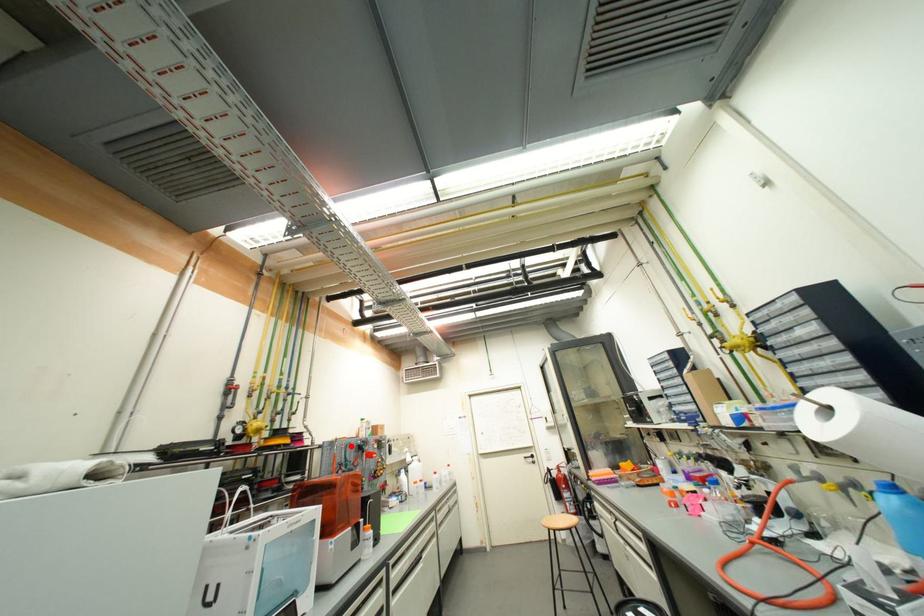
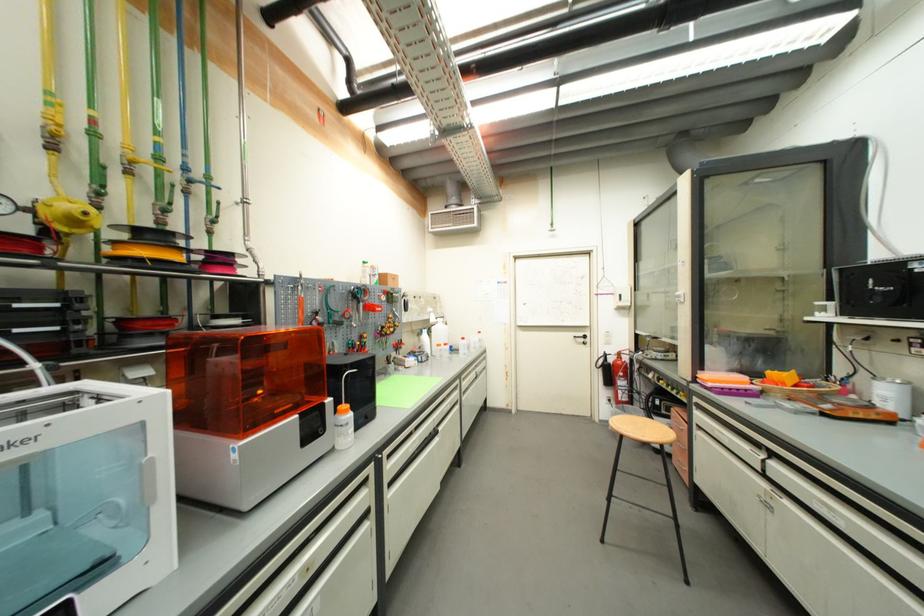
The point at the highlighted location is marked in the first image. Where is the corresponding point in the second image?

(334, 289)